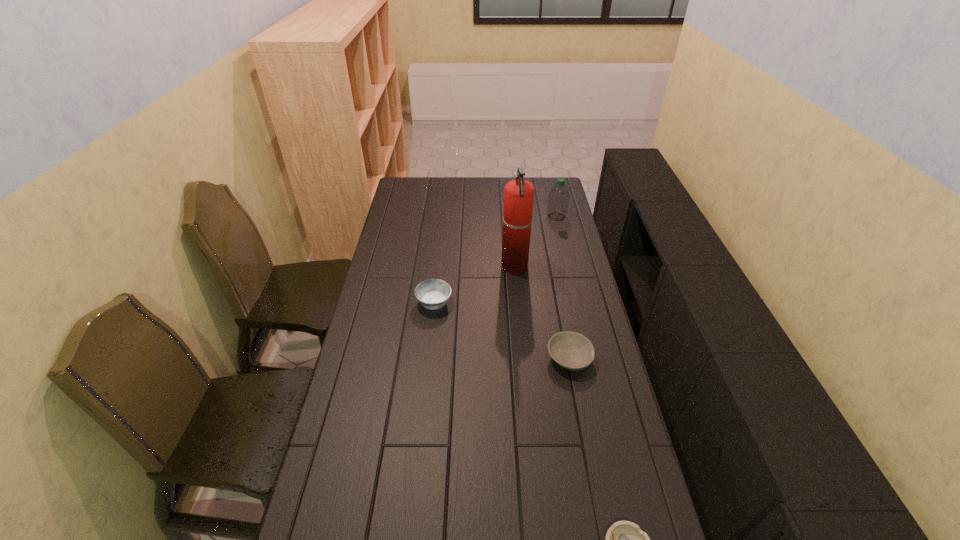
This screenshot has height=540, width=960. Identify the location of the second farthest object. (518, 194).

This screenshot has height=540, width=960. I want to click on the tallest object, so click(x=518, y=194).

This screenshot has height=540, width=960. In order to click on water bottle in this screenshot , I will do [558, 198].

At what (x,y) coordinates should I click in order to perform the action: click on the second tallest object. Please return your answer as a coordinate pair (x, y). This screenshot has width=960, height=540. Looking at the image, I should click on (558, 198).

In order to click on the leftmost object in this screenshot , I will do `click(433, 293)`.

Find the location of a particular element. the third farthest object is located at coordinates (433, 293).

Where is `the fourth tallest object`? This screenshot has height=540, width=960. the fourth tallest object is located at coordinates (571, 350).

The height and width of the screenshot is (540, 960). Find the location of `the second nearest object`. the second nearest object is located at coordinates (571, 350).

I want to click on blank space located 0.300m with the nozzle and gauge on the fire extinguisher, so click(x=428, y=267).

What are the coordinates of `free space located 0.160m with the nozzle and gauge on the fire extinguisher` in the screenshot? It's located at coord(463,267).